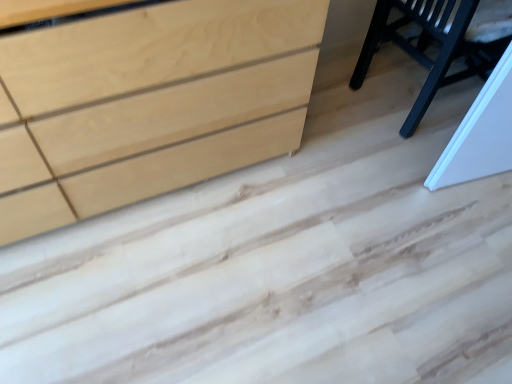
Question: From a real-world perspective, does natural wood chest of drawers at lower left stand above glossy black chair at upper right?

Choices:
 (A) no
 (B) yes

Answer: (B)

Question: Would you say glossy black chair at upper right is part of natural wood chest of drawers at lower left's contents?

Choices:
 (A) no
 (B) yes

Answer: (A)

Question: Is natural wood chest of drawers at lower left in contact with glossy black chair at upper right?

Choices:
 (A) no
 (B) yes

Answer: (A)

Question: Does natural wood chest of drawers at lower left have a lesser height compared to glossy black chair at upper right?

Choices:
 (A) no
 (B) yes

Answer: (A)

Question: Is natural wood chest of drawers at lower left further to camera compared to glossy black chair at upper right?

Choices:
 (A) no
 (B) yes

Answer: (A)

Question: From the image's perspective, would you say natural wood chest of drawers at lower left is shown under glossy black chair at upper right?

Choices:
 (A) no
 (B) yes

Answer: (B)

Question: Does glossy black chair at upper right come behind natural wood chest of drawers at lower left?

Choices:
 (A) yes
 (B) no

Answer: (A)

Question: From a real-world perspective, is glossy black chair at upper right located higher than natural wood chest of drawers at lower left?

Choices:
 (A) yes
 (B) no

Answer: (B)

Question: From the image's perspective, does glossy black chair at upper right appear higher than natural wood chest of drawers at lower left?

Choices:
 (A) no
 (B) yes

Answer: (B)

Question: Is natural wood chest of drawers at lower left at the back of glossy black chair at upper right?

Choices:
 (A) yes
 (B) no

Answer: (B)

Question: Is glossy black chair at upper right positioned in front of natural wood chest of drawers at lower left?

Choices:
 (A) yes
 (B) no

Answer: (B)

Question: Is glossy black chair at upper right wider than natural wood chest of drawers at lower left?

Choices:
 (A) no
 (B) yes

Answer: (B)

Question: Is glossy black chair at upper right inside or outside of natural wood chest of drawers at lower left?

Choices:
 (A) outside
 (B) inside

Answer: (A)